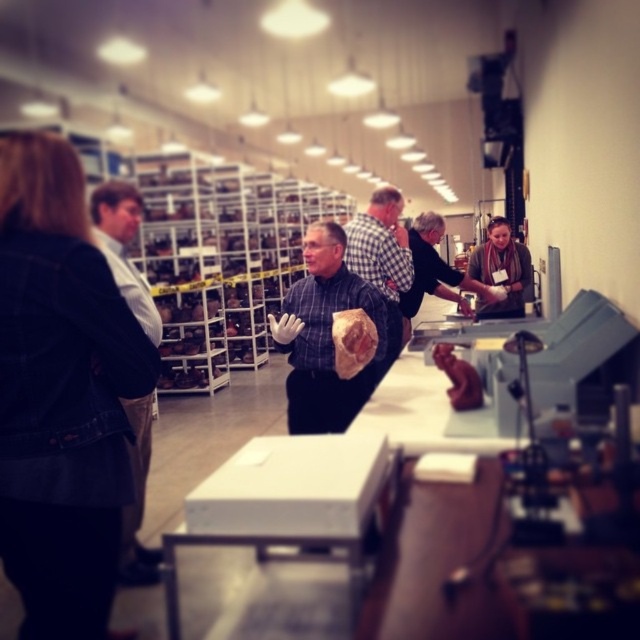
You are standing at the counter in the museum and see the denim jacket at left and the matte black shirt at center. Which one is positioned more to the left?

The denim jacket at left is positioned more to the left than the matte black shirt at center.

You are a visitor at the museum and want to know which object is higher between the white shirt at left and the brown wool scarf at upper right. Can you tell me based on the scene?

The white shirt at left is taller than the brown wool scarf at upper right, so the white shirt at left is higher.

In the museum scene, you see a white shirt at left and a brown wool scarf at upper right. Which object is larger in size?

The white shirt at left is bigger than the brown wool scarf at upper right.